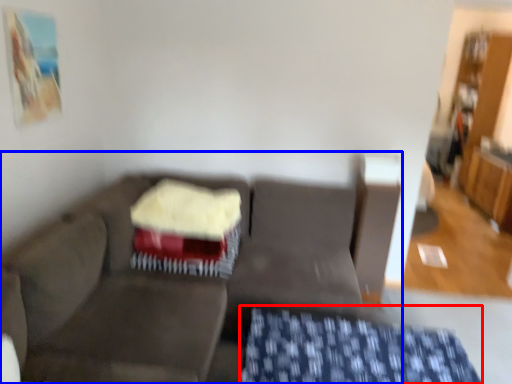
Question: Among these objects, which one is farthest to the camera, tablecloth (highlighted by a red box) or studio couch (highlighted by a blue box)?

Choices:
 (A) tablecloth
 (B) studio couch

Answer: (A)